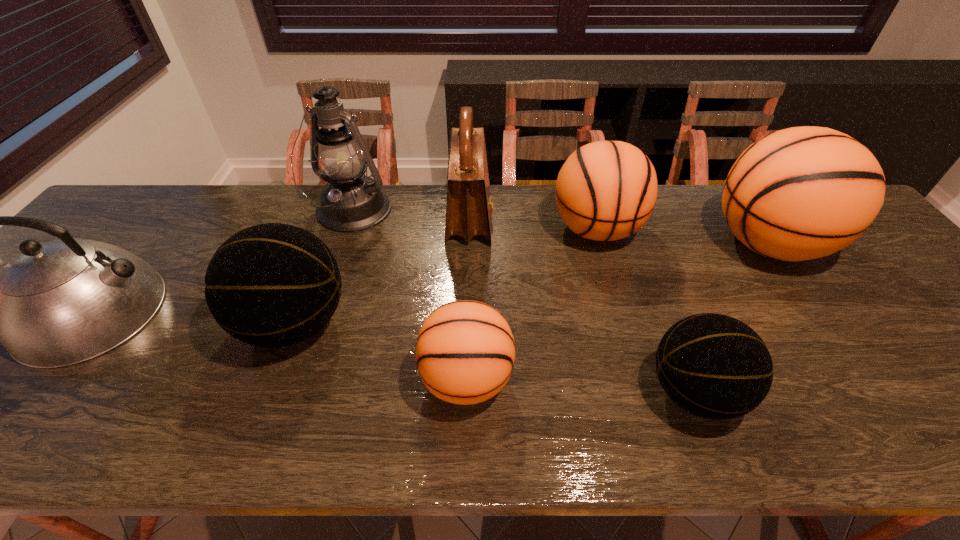
This screenshot has width=960, height=540. I want to click on object located in the far right corner section of the desktop, so click(x=801, y=193).

The height and width of the screenshot is (540, 960). In order to click on vacant space at the far edge of the desktop in this screenshot , I will do `click(175, 233)`.

Locate an element on the screen. Image resolution: width=960 pixels, height=540 pixels. free space at the right edge is located at coordinates (885, 268).

In the image, there is a desktop. Find the location of `vacant space at the far left corner`. vacant space at the far left corner is located at coordinates (170, 201).

Image resolution: width=960 pixels, height=540 pixels. I want to click on blank region between the second basketball from left to right and the rightmost basketball, so click(x=616, y=312).

Image resolution: width=960 pixels, height=540 pixels. I want to click on free spot between the shoulder bag and the smallest orange basketball, so click(468, 299).

This screenshot has height=540, width=960. Find the location of `empty space that is in between the rightmost object and the oil lamp`. empty space that is in between the rightmost object and the oil lamp is located at coordinates click(559, 228).

Where is `vacant space in between the bigger black basketball and the fourth basketball from right to left`? This screenshot has width=960, height=540. vacant space in between the bigger black basketball and the fourth basketball from right to left is located at coordinates (381, 352).

This screenshot has width=960, height=540. I want to click on unoccupied area between the smaller black basketball and the shoulder bag, so click(x=582, y=306).

Locate which object ranks fourth in proximity to the leftmost object. Please provide its 2D coordinates. Your answer should be formatted as a tuple, i.e. [(x, y)], where the tuple contains the x and y coordinates of a point satisfying the conditions above.

[(469, 209)]